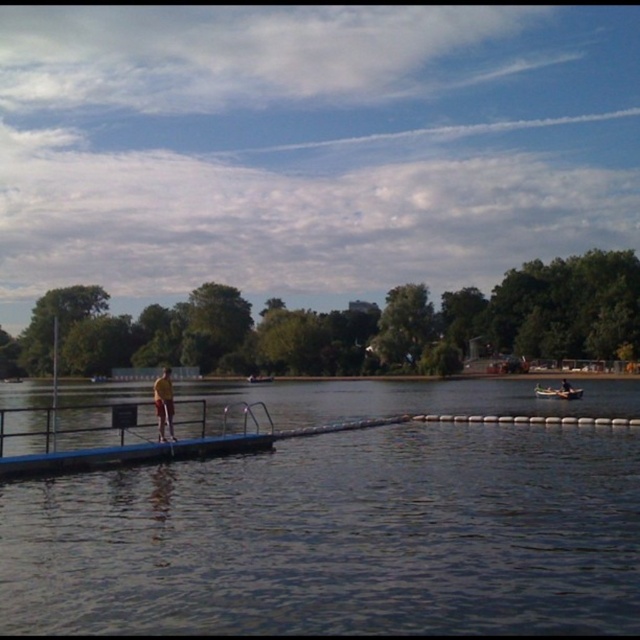
What do you see at coordinates (163, 404) in the screenshot? Image resolution: width=640 pixels, height=640 pixels. I see `yellow fabric person at center` at bounding box center [163, 404].

Can you confirm if yellow fabric person at center is taller than wooden canoe at center?

Indeed, yellow fabric person at center has a greater height compared to wooden canoe at center.

At what (x,y) coordinates should I click in order to perform the action: click on yellow fabric person at center. Please return your answer as a coordinate pair (x, y). Looking at the image, I should click on (163, 404).

This screenshot has height=640, width=640. In order to click on yellow fabric person at center in this screenshot , I will do `click(163, 404)`.

Does point (170, 388) come closer to viewer compared to point (563, 384)?

That is True.

Does yellow fabric person at center appear on the left side of wooden boat at lower right?

Correct, you'll find yellow fabric person at center to the left of wooden boat at lower right.

Where is `yellow fabric person at center`? The image size is (640, 640). yellow fabric person at center is located at coordinates (163, 404).

Locate an element on the screen. Image resolution: width=640 pixels, height=640 pixels. yellow fabric person at center is located at coordinates (163, 404).

Can you confirm if dark blue water at center is wider than wooden canoe at center?

Yes.

Is point (193, 528) positioned before point (268, 381)?

Yes, it is.

Where is `dark blue water at center`? dark blue water at center is located at coordinates (339, 538).